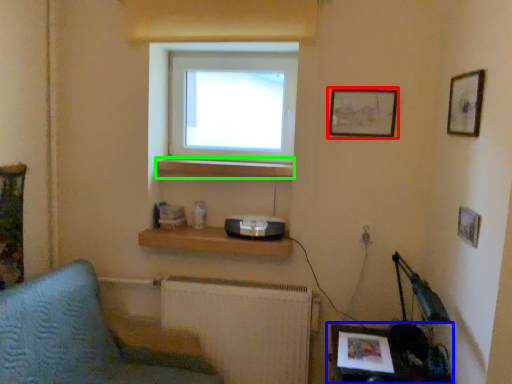
Question: Estimate the real-world distances between objects in this image. Which object is farther from picture frame (highlighted by a red box), table (highlighted by a blue box) or window sill (highlighted by a green box)?

Choices:
 (A) table
 (B) window sill

Answer: (A)